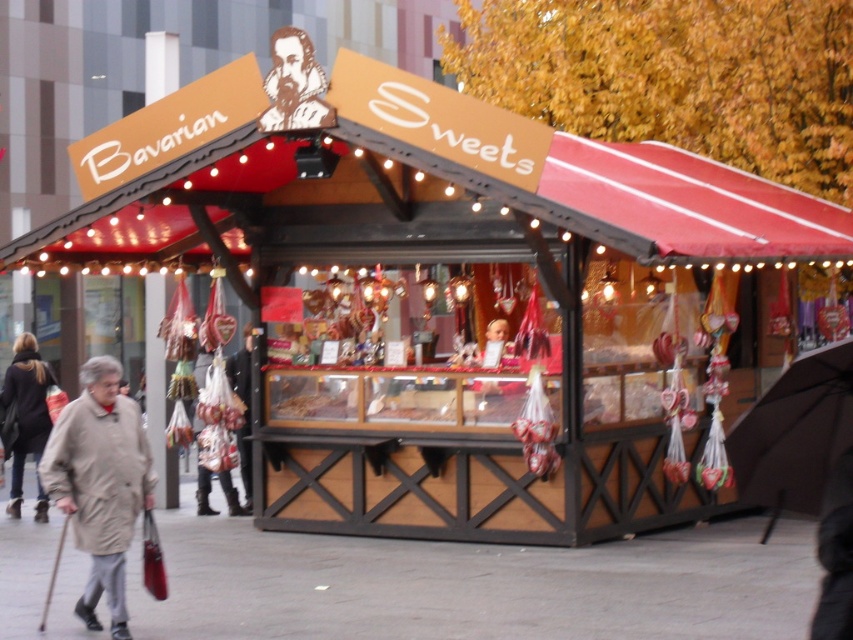
Who is shorter, smooth concrete pavement at center or light beige coat at lower left?

smooth concrete pavement at center is shorter.

Can you confirm if smooth concrete pavement at center is smaller than light beige coat at lower left?

Correct, smooth concrete pavement at center occupies less space than light beige coat at lower left.

What are the coordinates of `smooth concrete pavement at center` in the screenshot? It's located at (476, 584).

Who is lower down, beige fabric coat at lower left or black fabric umbrella at lower right?

beige fabric coat at lower left is below.

In the scene shown: Can you confirm if beige fabric coat at lower left is shorter than black fabric umbrella at lower right?

No.

Between point (129, 484) and point (792, 449), which one is positioned behind?

Point (129, 484)

You are a GUI agent. You are given a task and a screenshot of the screen. Output one action in this format:
    pyautogui.click(x=<x>, y=<y>)
    Task: Click on the beige fabric coat at lower left
    This screenshot has height=640, width=853.
    Given the screenshot: What is the action you would take?
    pyautogui.click(x=100, y=483)

I want to click on smooth concrete pavement at center, so click(476, 584).

Which is more to the right, smooth concrete pavement at center or black paper cutout at upper center?

Positioned to the right is black paper cutout at upper center.

Which is behind, point (383, 620) or point (312, 115)?

The point (312, 115) is behind.

Image resolution: width=853 pixels, height=640 pixels. Find the location of `smooth concrete pavement at center`. smooth concrete pavement at center is located at coordinates (476, 584).